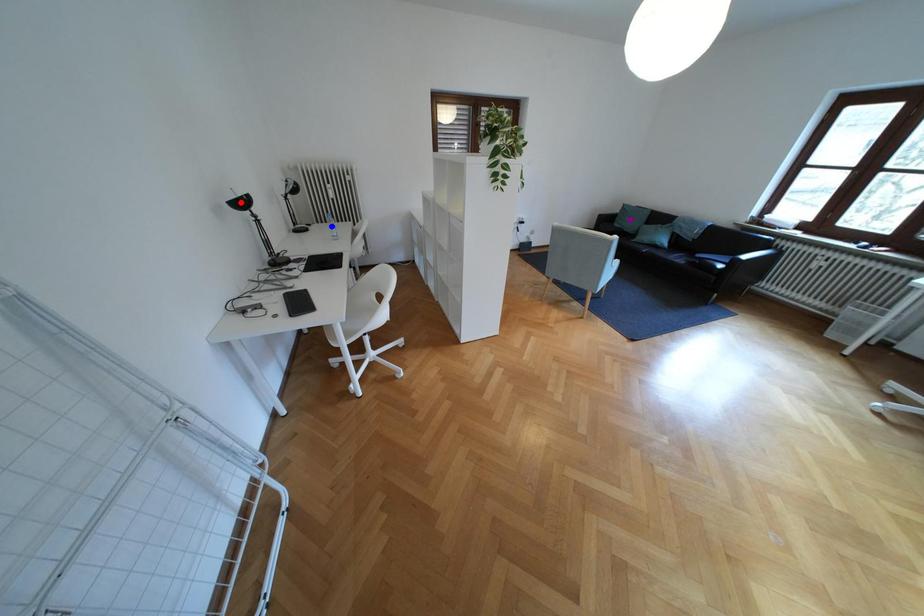
Order these from nearest to farthest:
purple point
red point
blue point

red point < blue point < purple point